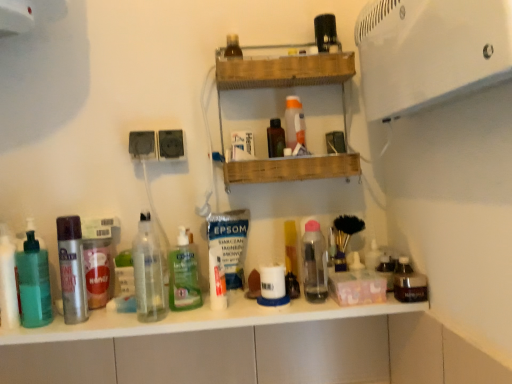
Where is `vacant region to the left of white plastic jar at center, which is the 4th toiletry from left to right`? The height and width of the screenshot is (384, 512). vacant region to the left of white plastic jar at center, which is the 4th toiletry from left to right is located at coordinates (218, 316).